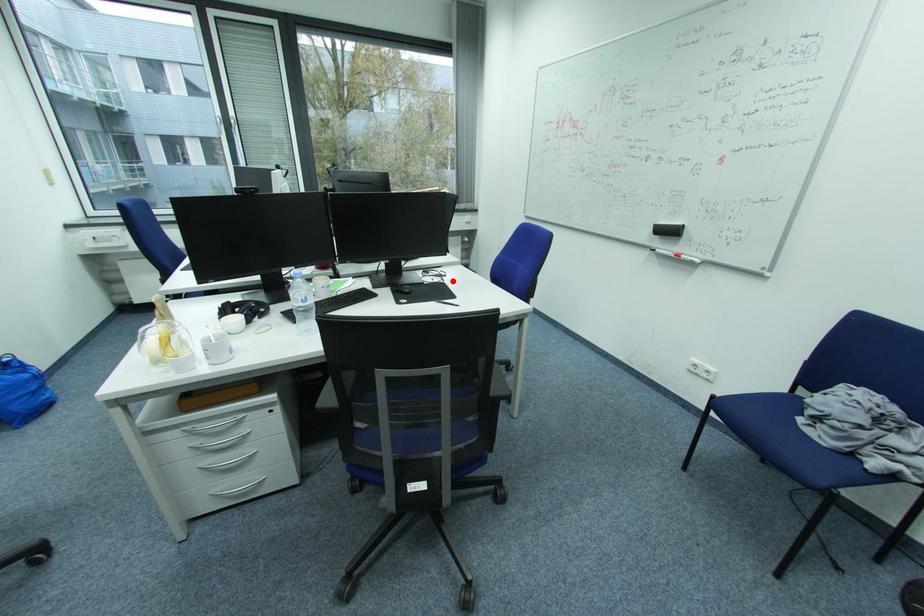
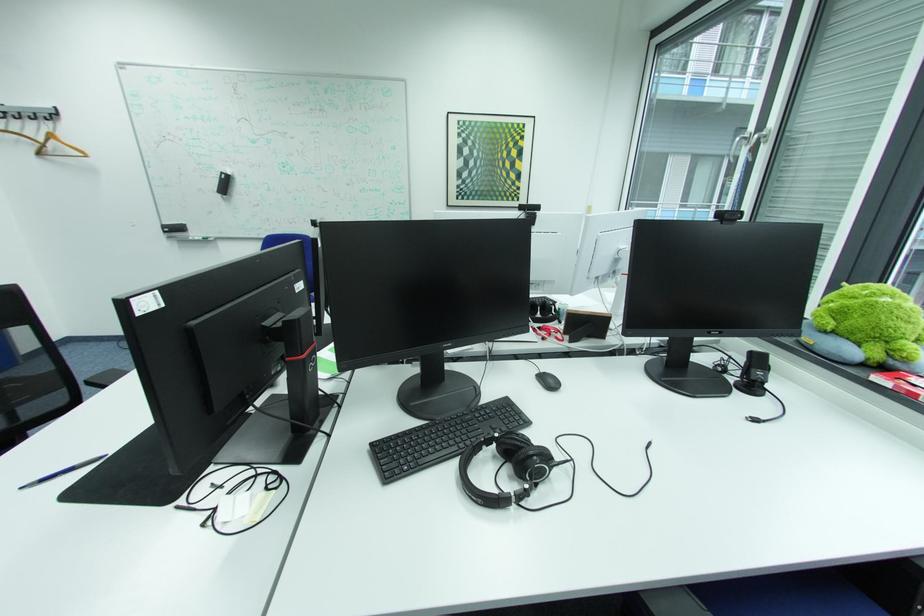
Locate, in the second image, the point that corresponds to the highlighted location in the first image.

(187, 508)